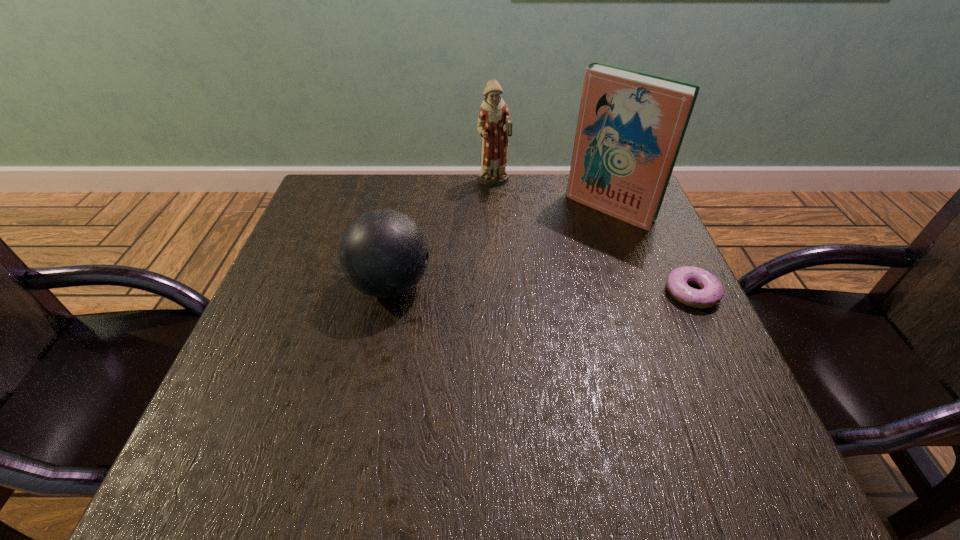
The width and height of the screenshot is (960, 540). In the image, there is a desktop. Find the location of `free space at the near edge`. free space at the near edge is located at coordinates point(351,410).

In the image, there is a desktop. Find the location of `vacant region at the left edge`. vacant region at the left edge is located at coordinates (305, 301).

At what (x,y) coordinates should I click in order to perform the action: click on vacant region at the far left corner of the desktop. Please return your answer as a coordinate pair (x, y). Looking at the image, I should click on (358, 184).

You are a GUI agent. You are given a task and a screenshot of the screen. Output one action in this format:
    pyautogui.click(x=<x>, y=<y>)
    Task: Click on the free space at the near left corner of the desktop
    The image size is (960, 540).
    Given the screenshot: What is the action you would take?
    pyautogui.click(x=238, y=402)

In the image, there is a desktop. At what (x,y) coordinates should I click in order to perform the action: click on vacant space at the far right corner. Please return your answer as a coordinate pair (x, y). Looking at the image, I should click on (596, 224).

Where is `free space between the figurine and the second shortest object`? Image resolution: width=960 pixels, height=540 pixels. free space between the figurine and the second shortest object is located at coordinates (442, 234).

I want to click on free space between the tallest object and the leftmost object, so click(x=500, y=247).

Find the location of a particular element. The image size is (960, 540). free point between the doughnut and the tallest object is located at coordinates (651, 251).

This screenshot has width=960, height=540. Find the location of `vacant area that lies between the second object from left to right and the second shortest object`. vacant area that lies between the second object from left to right and the second shortest object is located at coordinates (442, 234).

At what (x,y) coordinates should I click in order to perform the action: click on free space between the figurine and the shortest object. Please return your answer as a coordinate pair (x, y). Looking at the image, I should click on (592, 238).